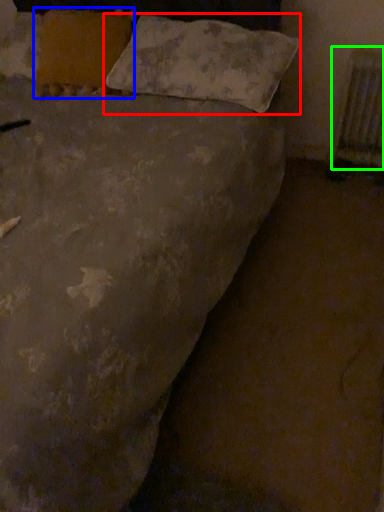
Question: Which is nearer to the pillow (highlighted by a red box)? pillow (highlighted by a blue box) or radiator (highlighted by a green box).

Choices:
 (A) pillow
 (B) radiator

Answer: (A)